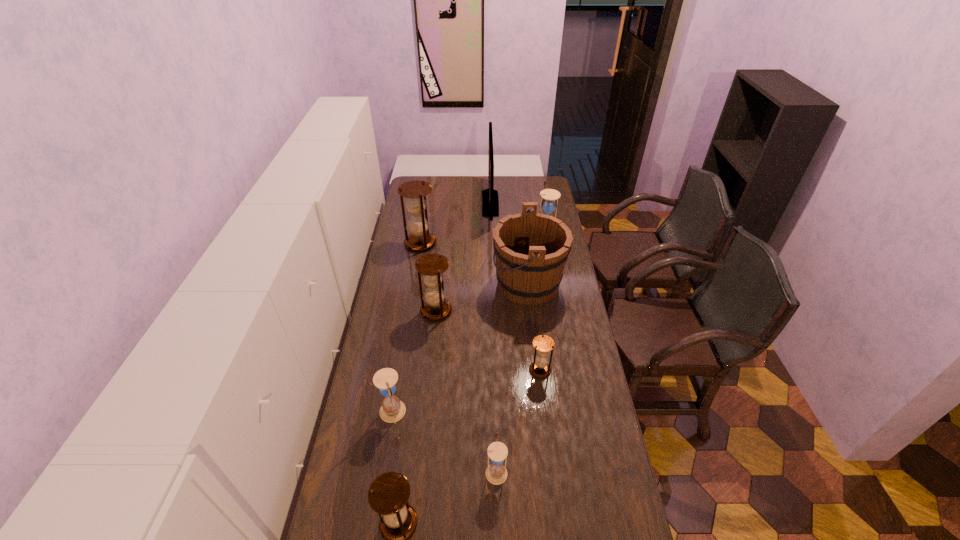
At what (x,y) coordinates should I click in order to perform the action: click on monitor. Please return your answer as a coordinate pair (x, y). This screenshot has height=540, width=960. Looking at the image, I should click on (490, 202).

The height and width of the screenshot is (540, 960). I want to click on wine bucket, so click(531, 249).

Where is `the tallest hourglass`? The height and width of the screenshot is (540, 960). the tallest hourglass is located at coordinates (416, 191).

Locate an element on the screen. The image size is (960, 540). the biggest brown hourglass is located at coordinates (416, 191).

Where is `the second biggest brown hourglass`? the second biggest brown hourglass is located at coordinates (432, 266).

You are a GUI agent. You are given a task and a screenshot of the screen. Output one action in this format:
    pyautogui.click(x=<x>, y=<y>)
    Task: Click on the fifth nearest hourglass
    Image resolution: width=960 pixels, height=540 pixels.
    Given the screenshot: What is the action you would take?
    pyautogui.click(x=432, y=266)

Find the location of a particular element. This screenshot has width=960, height=540. the rightmost hourglass is located at coordinates (550, 197).

The height and width of the screenshot is (540, 960). I want to click on the biggest white hourglass, so click(x=550, y=197).

Where is `the leftmost white hourglass`? the leftmost white hourglass is located at coordinates (392, 410).

At what (x,y) coordinates should I click in order to perform the action: click on the third nearest hourglass. Please return your answer as a coordinate pair (x, y). The height and width of the screenshot is (540, 960). Looking at the image, I should click on (392, 410).